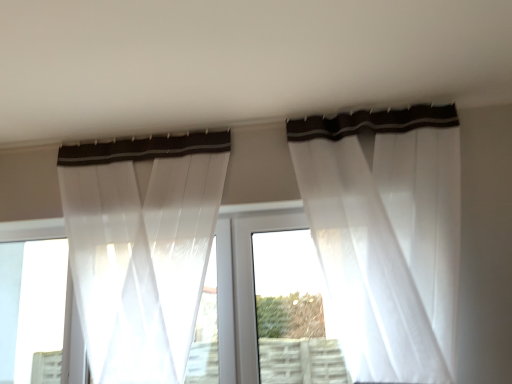
Question: Does point (109, 158) appear closer or farther from the camera than point (295, 226)?

Choices:
 (A) farther
 (B) closer

Answer: (A)

Question: Is sheer white curtain at left, placed as the second curtain when sorted from right to left, taller or shorter than white plastic window frame at center?

Choices:
 (A) tall
 (B) short

Answer: (A)

Question: Which object is the farthest from the sheer white curtain at left, placed as the 1th curtain when sorted from left to right?

Choices:
 (A) white plastic window frame at center
 (B) sheer white curtain at upper center, positioned as the first curtain in right-to-left order

Answer: (B)

Question: Considering the real-world distances, which object is farthest from the sheer white curtain at left, placed as the 1th curtain when sorted from left to right?

Choices:
 (A) white plastic window frame at center
 (B) sheer white curtain at upper center, positioned as the first curtain in right-to-left order

Answer: (B)